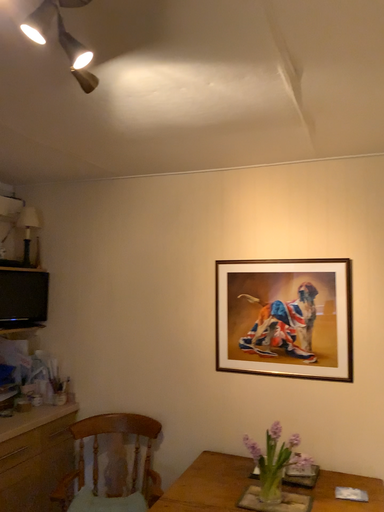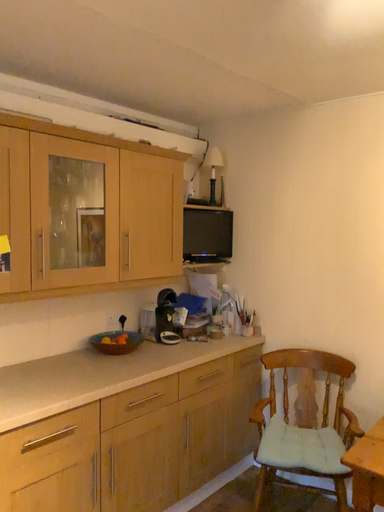
Question: How did the camera likely rotate when shooting the video?

Choices:
 (A) rotated right
 (B) rotated left

Answer: (B)